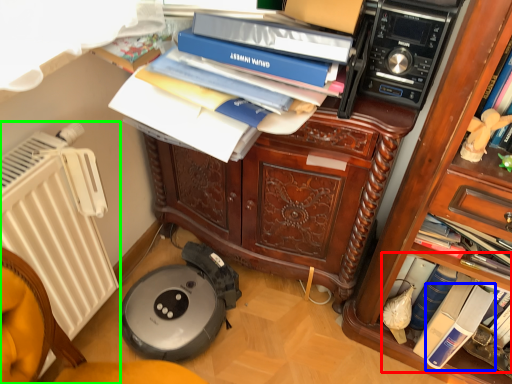
Question: Estimate the real-world distances between objects in this image. Which object is farther from book (highlighted by a red box), paperback book (highlighted by a blue box) or radiator (highlighted by a green box)?

Choices:
 (A) paperback book
 (B) radiator

Answer: (B)